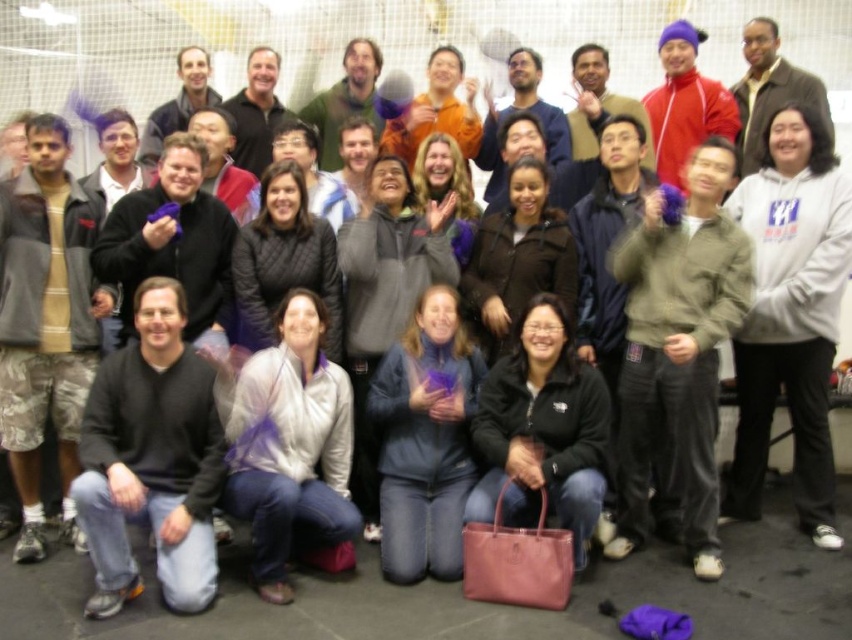
Which is behind, point (636, 502) or point (827, 404)?

Positioned behind is point (827, 404).

This screenshot has height=640, width=852. Describe the element at coordinates (678, 348) in the screenshot. I see `matte gray jacket at center` at that location.

Between point (665, 220) and point (730, 192), which one is positioned in front?

Point (665, 220) is more forward.

Identify the location of matte gray jacket at center. (678, 348).

Looking at this image, is white fleece hoodie at right to the right of black matte jacket at lower center from the viewer's perspective?

Indeed, white fleece hoodie at right is positioned on the right side of black matte jacket at lower center.

Locate an element on the screen. white fleece hoodie at right is located at coordinates (790, 316).

Where is `white fleece hoodie at right`? The image size is (852, 640). white fleece hoodie at right is located at coordinates (790, 316).

Does matte gray jacket at center appear on the right side of black matte jacket at lower center?

Correct, you'll find matte gray jacket at center to the right of black matte jacket at lower center.

Who is taller, matte gray jacket at center or black matte jacket at lower center?

With more height is matte gray jacket at center.

Which is in front, point (635, 461) or point (533, 390)?

Point (533, 390)

In order to click on matte gray jacket at center in this screenshot , I will do `click(678, 348)`.